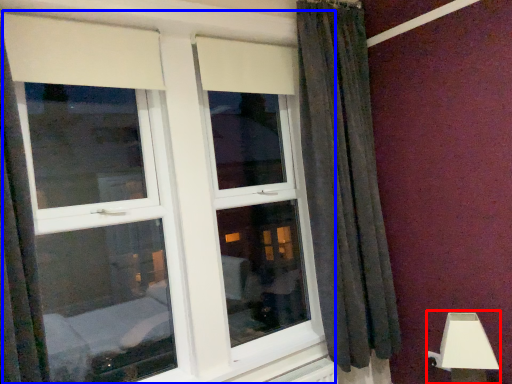
Question: Which object appears farthest to the camera in this image, table lamp (highlighted by a red box) or window (highlighted by a blue box)?

Choices:
 (A) table lamp
 (B) window

Answer: (A)